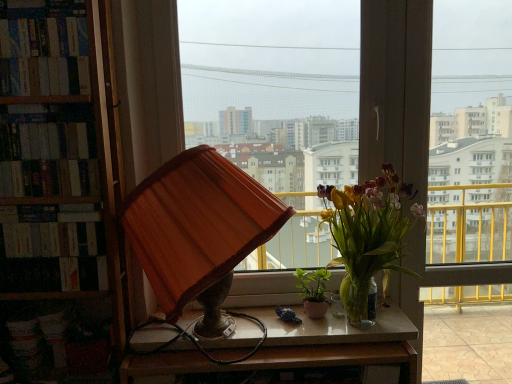
Find the location of a particular element. This screenshot has height=384, width=512. blank space above wooden desk at center (from a real-world perspective) is located at coordinates (288, 319).